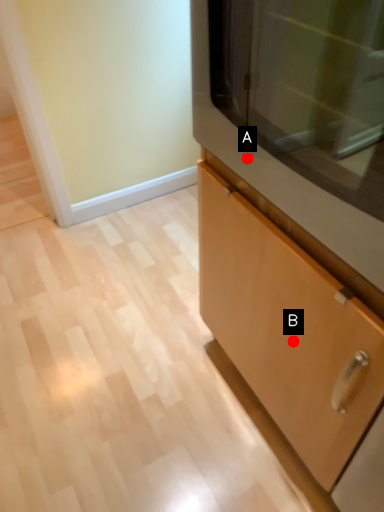
Question: Two points are circled on the image, labeled by A and B beside each circle. Among these points, which one is nearest to the camera?

Choices:
 (A) A is closer
 (B) B is closer

Answer: (A)